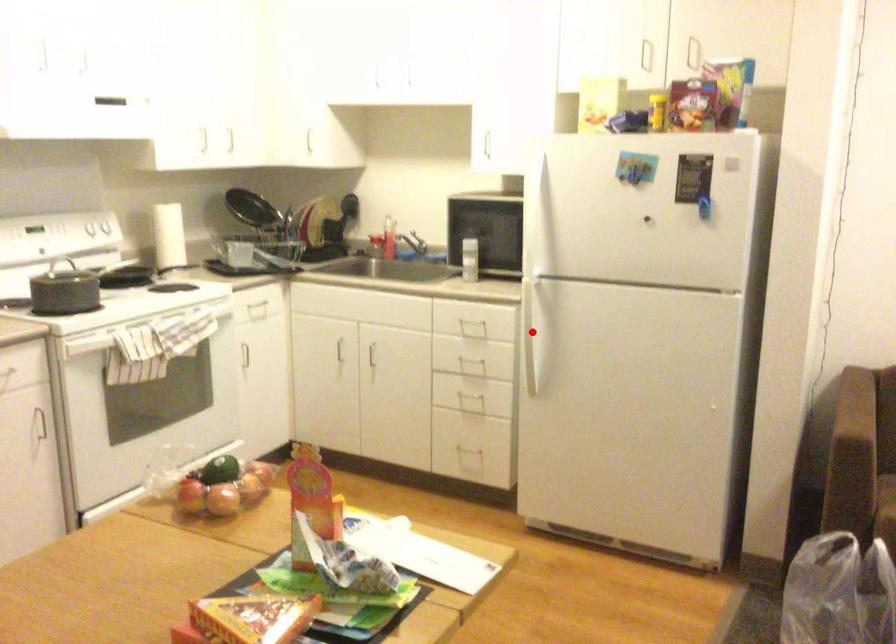
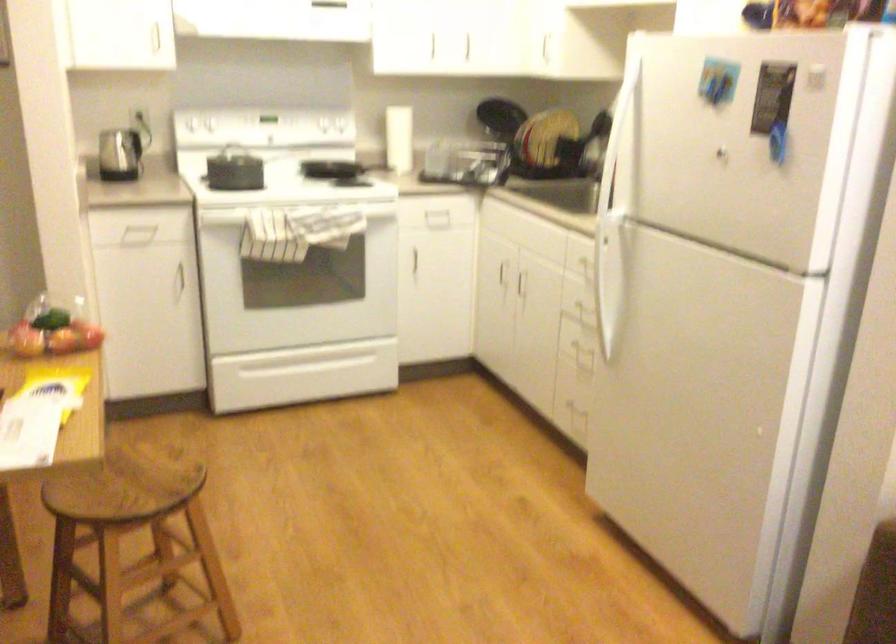
Find the pixel in the second image that matches the highlighted location in the first image.

(607, 283)